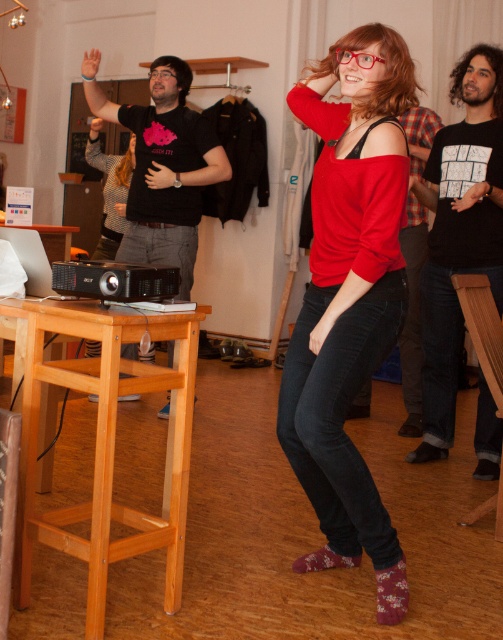
Question: Which object is the farthest from the matte red sweater at center?

Choices:
 (A) wooden bar stool at lower right
 (B) black matte projector at left

Answer: (B)

Question: Which point is farther to the camera?

Choices:
 (A) (500, 216)
 (B) (496, 525)
 (C) (104, 387)

Answer: (A)

Question: Which point appears closest to the camera in this image?

Choices:
 (A) (116, 413)
 (B) (178, 168)
 (C) (351, 33)

Answer: (C)

Question: Can you confirm if black cotton t-shirt at right is positioned to the left of wooden bar stool at lower right?

Choices:
 (A) no
 (B) yes

Answer: (A)

Question: Can you confirm if light brown wooden bar stool at lower left is positioned to the right of wooden bar stool at lower right?

Choices:
 (A) yes
 (B) no

Answer: (B)

Question: Does black cotton t-shirt at right appear on the right side of wooden bar stool at lower right?

Choices:
 (A) no
 (B) yes

Answer: (B)